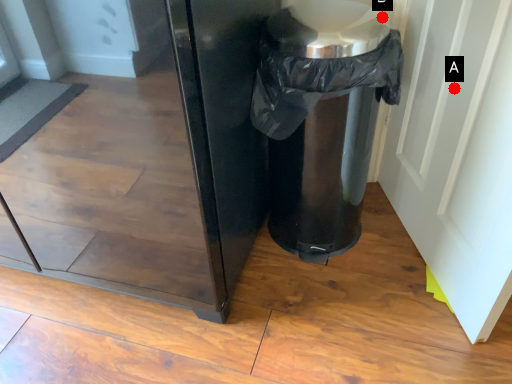
Question: Two points are circled on the image, labeled by A and B beside each circle. Which point appears farthest from the camera in this image?

Choices:
 (A) A is further
 (B) B is further

Answer: (B)